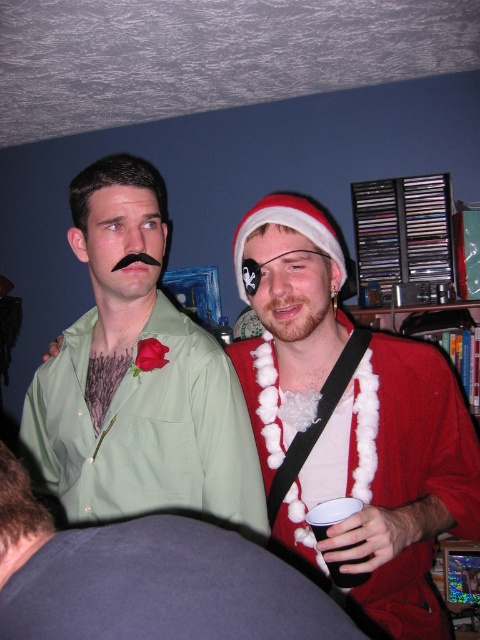
Question: Is fuzzy white boa at center wider than reddish-brown fuzzy beard at center?

Choices:
 (A) yes
 (B) no

Answer: (A)

Question: Is green matte shirt at upper left bigger than reddish-brown fuzzy beard at center?

Choices:
 (A) yes
 (B) no

Answer: (A)

Question: Among these objects, which one is nearest to the camera?

Choices:
 (A) green matte shirt at upper left
 (B) fuzzy white boa at center
 (C) reddish-brown fuzzy beard at center

Answer: (A)

Question: Where is green matte shirt at center located in relation to reddish-brown fuzzy beard at center in the image?

Choices:
 (A) below
 (B) above

Answer: (A)

Question: Which of the following is the closest to the observer?

Choices:
 (A) (256, 508)
 (B) (145, 616)
 (C) (286, 308)
 (D) (252, 364)

Answer: (B)

Question: Which point is farther to the camera?

Choices:
 (A) coord(396,584)
 (B) coord(186,577)

Answer: (A)